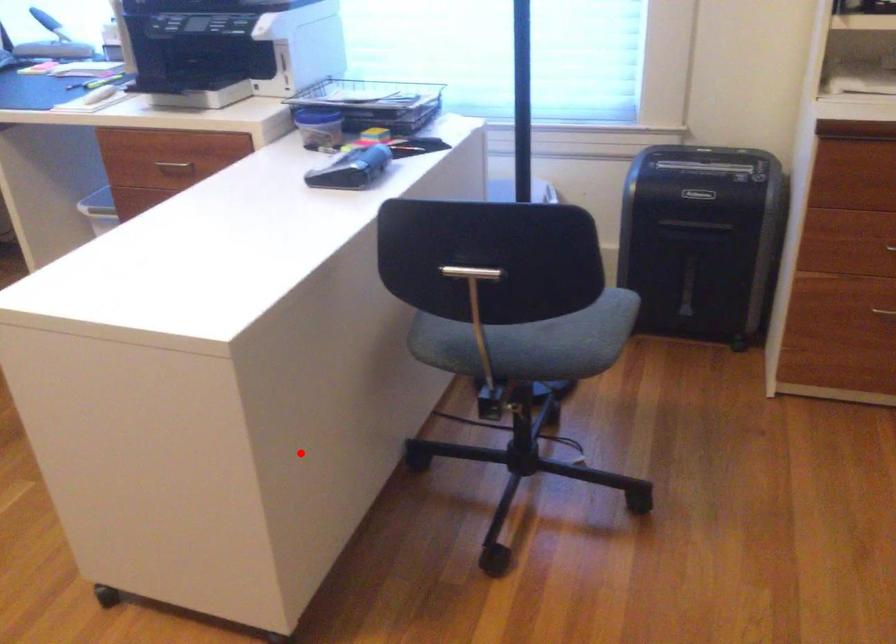
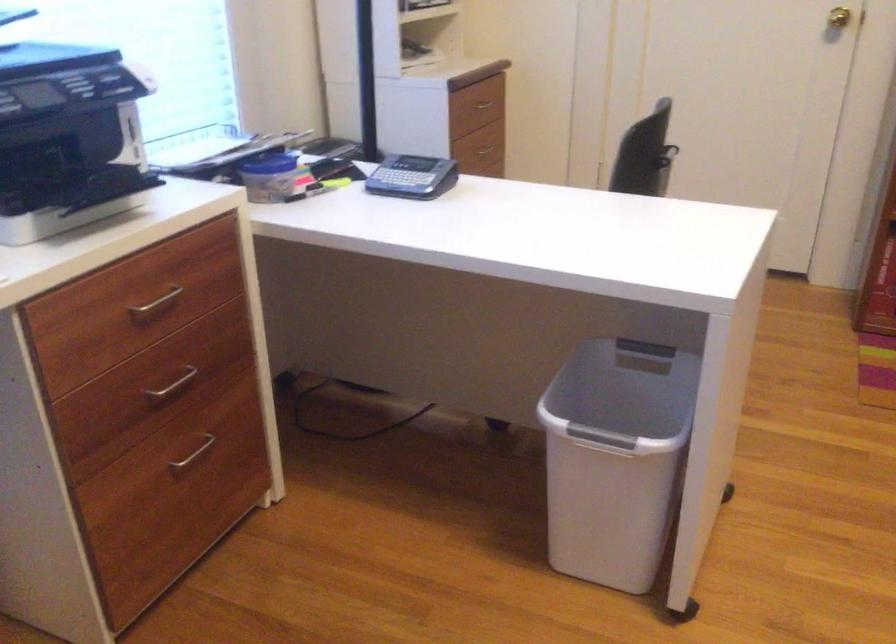
Find the pixel in the second image that matches the highlighted location in the first image.

(625, 389)